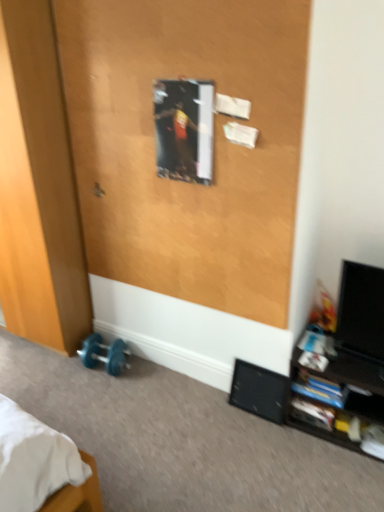
Measure the distance between point (279, 376) and camera.

2.05 meters.

I want to click on wooden door at lower left, marked as the second screen door in a right-to-left arrangement, so click(x=38, y=188).

Image resolution: width=384 pixels, height=512 pixels. What do you see at coordinates (38, 188) in the screenshot? I see `wooden door at lower left, the 1th screen door positioned from the left` at bounding box center [38, 188].

What do you see at coordinates (361, 311) in the screenshot? This screenshot has height=512, width=384. I see `black glossy monitor at right` at bounding box center [361, 311].

Identify the location of blue rubber dumbbell at lower left. This screenshot has height=512, width=384. (103, 355).

The image size is (384, 512). Describe the element at coordinates (103, 355) in the screenshot. I see `blue rubber dumbbell at lower left` at that location.

This screenshot has width=384, height=512. I want to click on metallic silver door handle at upper center, so click(x=98, y=190).

Image resolution: width=384 pixels, height=512 pixels. In order to click on black matte speaker at lower right in this screenshot , I will do `click(260, 391)`.

From the image's perspective, is black glossy monitor at right below blue rubber dumbbell at lower left?

Incorrect, from the image's perspective, black glossy monitor at right is higher than blue rubber dumbbell at lower left.

Is point (381, 337) closer to camera compared to point (87, 364)?

Yes, it is.

How much distance is there between black glossy monitor at right and blue rubber dumbbell at lower left?

black glossy monitor at right and blue rubber dumbbell at lower left are 4.25 feet apart from each other.

Considering the relative positions of black glossy monitor at right and blue rubber dumbbell at lower left in the image provided, is black glossy monitor at right to the right of blue rubber dumbbell at lower left from the viewer's perspective?

Yes.

Does black matte speaker at lower right come in front of blue rubber dumbbell at lower left?

Yes, black matte speaker at lower right is closer to the viewer.

Can you confirm if black matte speaker at lower right is smaller than blue rubber dumbbell at lower left?

Indeed, black matte speaker at lower right has a smaller size compared to blue rubber dumbbell at lower left.

Consider the image. Would you say black matte speaker at lower right is a long distance from blue rubber dumbbell at lower left?

No.

Is black glossy shelf at lower right closer to the viewer compared to blue rubber dumbbell at lower left?

Yes, black glossy shelf at lower right is closer to the camera.

Which of these two, black glossy shelf at lower right or blue rubber dumbbell at lower left, is bigger?

Bigger between the two is black glossy shelf at lower right.

Is blue rubber dumbbell at lower left at the back of black glossy shelf at lower right?

No, blue rubber dumbbell at lower left is not at the back of black glossy shelf at lower right.

From a real-world perspective, which object rests below the other?

black glossy monitor at right.

Is point (356, 279) closer to viewer compared to point (81, 87)?

Yes, point (356, 279) is in front of point (81, 87).

Is black glossy monitor at right completely or partially outside of wooden poster at upper center, which is counted as the 1th screen door, starting from the right?

black glossy monitor at right lies outside wooden poster at upper center, which is counted as the 1th screen door, starting from the right,'s area.

Does black glossy monitor at right have a larger size compared to wooden poster at upper center, which is counted as the 1th screen door, starting from the right?

Actually, black glossy monitor at right might be smaller than wooden poster at upper center, which is counted as the 1th screen door, starting from the right.

Can you tell me how much wooden poster at upper center, which is counted as the 1th screen door, starting from the right, and black glossy shelf at lower right differ in facing direction?

They differ by 0.695 degrees in their facing directions.

Is wooden poster at upper center, arranged as the second screen door when viewed from the left, surrounding black glossy shelf at lower right?

Definitely not — black glossy shelf at lower right is not inside wooden poster at upper center, arranged as the second screen door when viewed from the left.

Locate an element on the screen. This screenshot has width=384, height=512. shelf directly beneath the wooden poster at upper center, arranged as the second screen door when viewed from the left (from a real-world perspective) is located at coordinates (340, 401).

Consider the image. Is wooden poster at upper center, which is counted as the 1th screen door, starting from the right, in contact with black glossy shelf at lower right?

No, wooden poster at upper center, which is counted as the 1th screen door, starting from the right, is not next to black glossy shelf at lower right.

In terms of height, does blue rubber dumbbell at lower left look taller or shorter compared to black glossy monitor at right?

Clearly, blue rubber dumbbell at lower left is shorter compared to black glossy monitor at right.

From the image's perspective, which is below, blue rubber dumbbell at lower left or black glossy monitor at right?

blue rubber dumbbell at lower left.

Could you tell me if blue rubber dumbbell at lower left is facing black glossy monitor at right?

No, blue rubber dumbbell at lower left is not aimed at black glossy monitor at right.

Are blue rubber dumbbell at lower left and black glossy monitor at right located far from each other?

Yes.

Can you confirm if blue rubber dumbbell at lower left is wider than metallic silver door handle at upper center?

Correct, the width of blue rubber dumbbell at lower left exceeds that of metallic silver door handle at upper center.

Measure the distance from blue rubber dumbbell at lower left to metallic silver door handle at upper center.

blue rubber dumbbell at lower left is 35.76 inches away from metallic silver door handle at upper center.

Is blue rubber dumbbell at lower left touching metallic silver door handle at upper center?

No, blue rubber dumbbell at lower left is not next to metallic silver door handle at upper center.

Is blue rubber dumbbell at lower left facing away from metallic silver door handle at upper center?

No, blue rubber dumbbell at lower left is not facing the opposite direction of metallic silver door handle at upper center.

Locate an element on the screen. dumbbell below the black glossy monitor at right (from a real-world perspective) is located at coordinates (103, 355).

Locate an element on the screen. The height and width of the screenshot is (512, 384). dumbbell located above the black matte speaker at lower right (from the image's perspective) is located at coordinates tap(103, 355).

Considering their positions, is blue rubber dumbbell at lower left positioned closer to black glossy monitor at right than wooden door at lower left, the 1th screen door positioned from the left?

Among the two, blue rubber dumbbell at lower left is located nearer to black glossy monitor at right.

Which object lies nearer to the anchor point wooden door at lower left, the 1th screen door positioned from the left, black glossy monitor at right or black glossy shelf at lower right?

black glossy shelf at lower right is positioned closer to the anchor wooden door at lower left, the 1th screen door positioned from the left.

Considering their positions, is black glossy monitor at right positioned further to blue rubber dumbbell at lower left than black glossy shelf at lower right?

black glossy monitor at right is positioned further to the anchor blue rubber dumbbell at lower left.

From the image, which object appears to be farther from metallic silver door handle at upper center, wooden poster at upper center, arranged as the second screen door when viewed from the left, or wooden door at lower left, the 1th screen door positioned from the left?

Among the two, wooden poster at upper center, arranged as the second screen door when viewed from the left, is located further to metallic silver door handle at upper center.

Looking at the image, which one is located closer to wooden poster at upper center, which is counted as the 1th screen door, starting from the right, black matte speaker at lower right or black glossy monitor at right?

black glossy monitor at right is positioned closer to the anchor wooden poster at upper center, which is counted as the 1th screen door, starting from the right.

Estimate the real-world distances between objects in this image. Which object is closer to wooden poster at upper center, which is counted as the 1th screen door, starting from the right, metallic silver door handle at upper center or wooden door at lower left, marked as the second screen door in a right-to-left arrangement?

Based on the image, wooden door at lower left, marked as the second screen door in a right-to-left arrangement, appears to be nearer to wooden poster at upper center, which is counted as the 1th screen door, starting from the right.

Looking at the image, which one is located further to metallic silver door handle at upper center, wooden door at lower left, marked as the second screen door in a right-to-left arrangement, or black matte speaker at lower right?

black matte speaker at lower right lies further to metallic silver door handle at upper center than the other object.

Estimate the real-world distances between objects in this image. Which object is closer to wooden poster at upper center, arranged as the second screen door when viewed from the left, blue rubber dumbbell at lower left or black matte speaker at lower right?

black matte speaker at lower right is closer to wooden poster at upper center, arranged as the second screen door when viewed from the left.

At what (x,y) coordinates should I click in order to perform the action: click on door handle located between wooden door at lower left, the 1th screen door positioned from the left, and black matte speaker at lower right in the left-right direction. Please return your answer as a coordinate pair (x, y). The width and height of the screenshot is (384, 512). Looking at the image, I should click on tap(98, 190).

Image resolution: width=384 pixels, height=512 pixels. I want to click on dumbbell situated between wooden door at lower left, marked as the second screen door in a right-to-left arrangement, and black glossy monitor at right from left to right, so click(x=103, y=355).

Find the location of a particular element. computer monitor between wooden door at lower left, the 1th screen door positioned from the left, and black glossy shelf at lower right from left to right is located at coordinates (361, 311).

Locate an element on the screen. door handle between wooden door at lower left, the 1th screen door positioned from the left, and blue rubber dumbbell at lower left in the up-down direction is located at coordinates (98, 190).